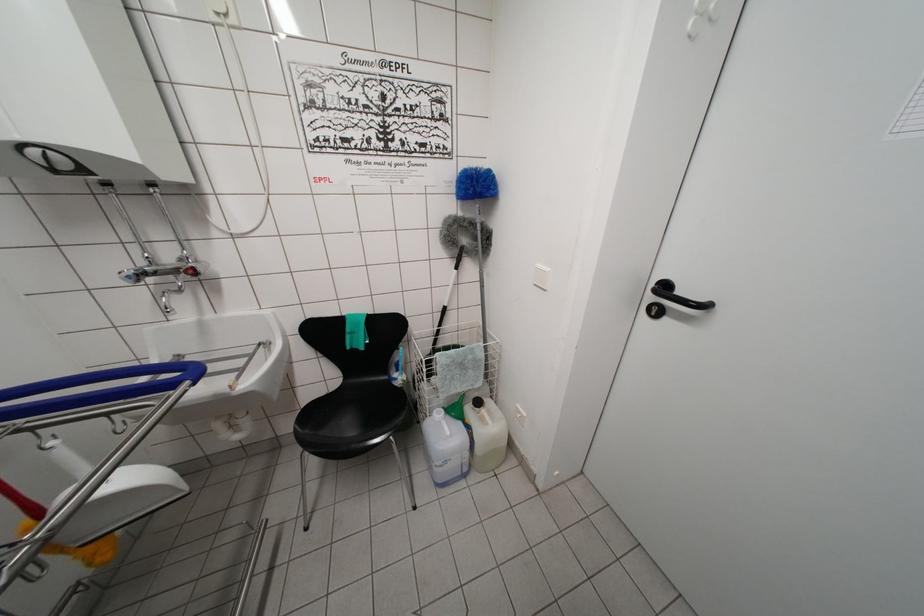
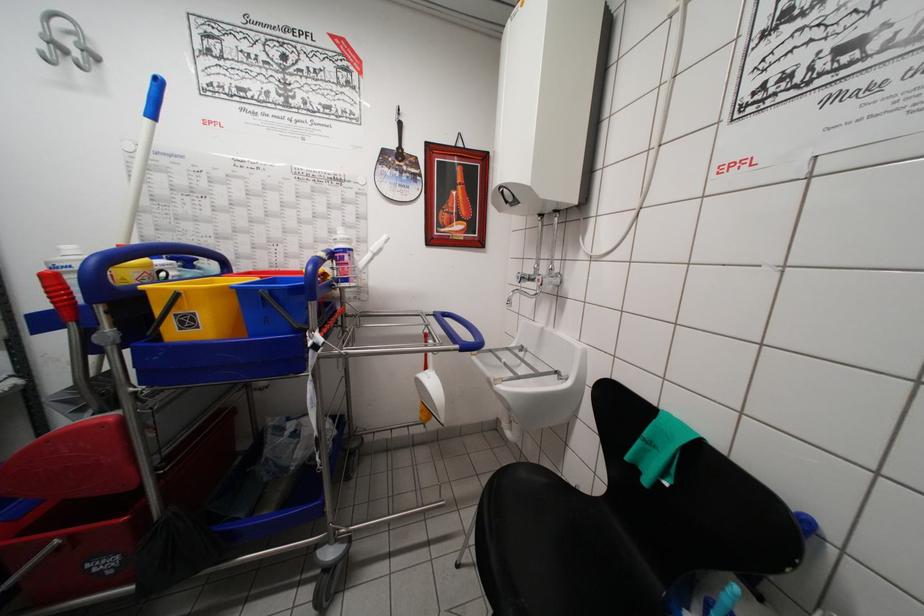
Question: The camera is either moving clockwise (left) or counter-clockwise (right) around the object. The first image is from the beginning of the video and the second image is from the end. Is the camera moving left or right when shooting the video?

Choices:
 (A) Left
 (B) Right

Answer: (B)